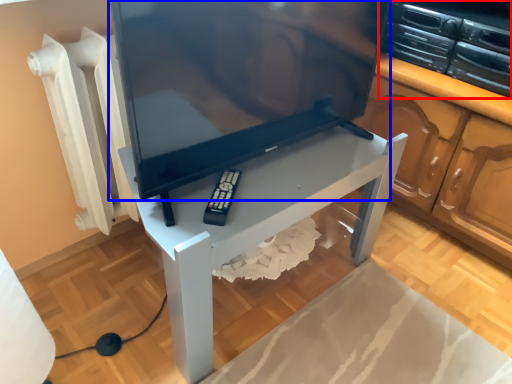
Question: Which of the following is the farthest to the observer, appliance (highlighted by a red box) or television (highlighted by a blue box)?

Choices:
 (A) appliance
 (B) television

Answer: (A)